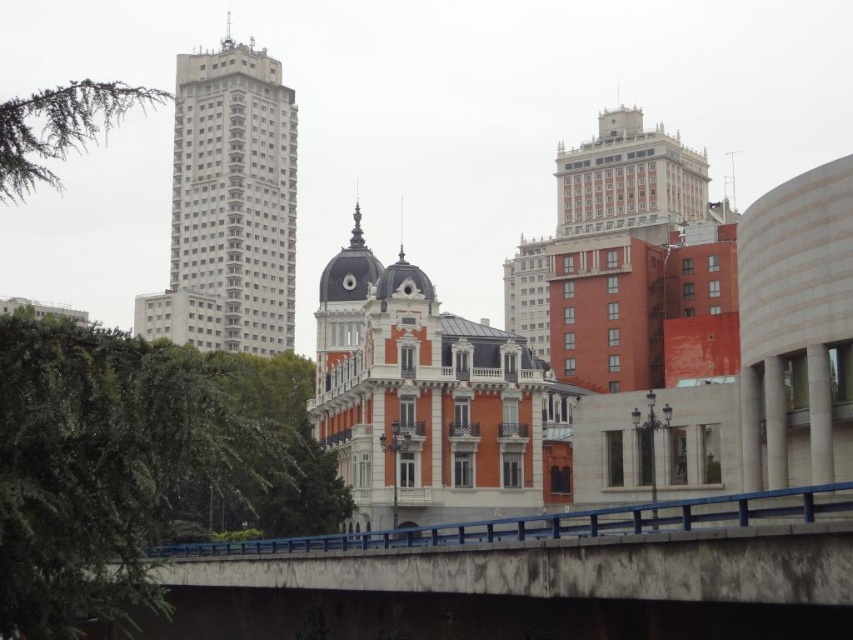
Can you confirm if green leafy tree at lower left is thinner than green needle-like leaves at upper left?

Correct, green leafy tree at lower left's width is less than green needle-like leaves at upper left's.

Is green leafy tree at lower left below green needle-like leaves at upper left?

Indeed, green leafy tree at lower left is positioned under green needle-like leaves at upper left.

Between point (45, 513) and point (67, 102), which one is positioned in front?

Point (45, 513) is more forward.

Where is `green leafy tree at lower left`? The image size is (853, 640). green leafy tree at lower left is located at coordinates (138, 465).

Can you confirm if blue concrete bridge at lower center is smaller than green leafy tree at lower left?

Yes.

What do you see at coordinates (537, 577) in the screenshot? I see `blue concrete bridge at lower center` at bounding box center [537, 577].

Which is in front, point (581, 529) or point (0, 488)?

Point (0, 488) is in front.

Locate an element on the screen. blue concrete bridge at lower center is located at coordinates (537, 577).

Between white smooth tower at upper left and green needle-like leaves at upper left, which one appears on the left side from the viewer's perspective?

green needle-like leaves at upper left

Is white smooth tower at upper left thinner than green needle-like leaves at upper left?

Yes.

Find the location of a particular element. The image size is (853, 640). white smooth tower at upper left is located at coordinates (229, 205).